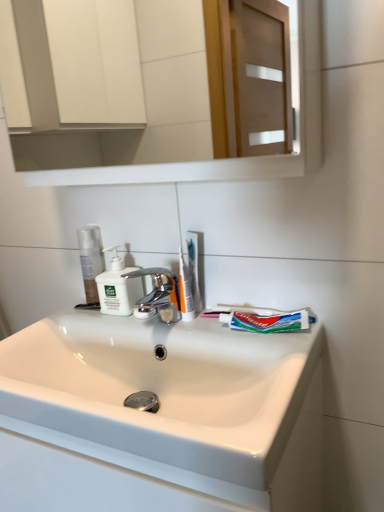
Locate an element on the screen. This screenshot has width=384, height=512. vacant position to the left of translucent plastic toothbrush at center is located at coordinates (132, 323).